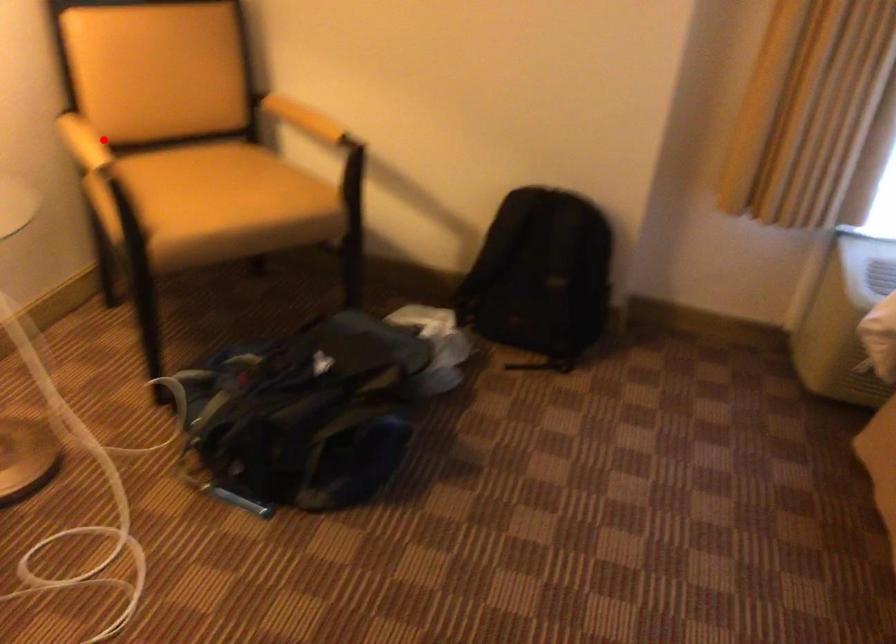
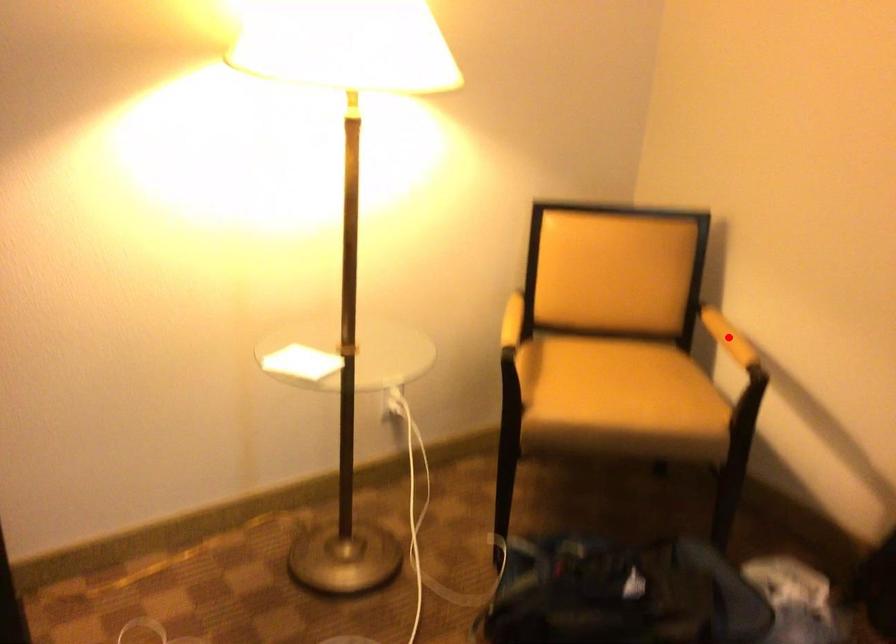
I am providing you with two images of the same scene from different viewpoints. A red point is marked on the first image and another point is marked on the second image. Does the point marked in image1 correspond to the same location as the one in image2?

No